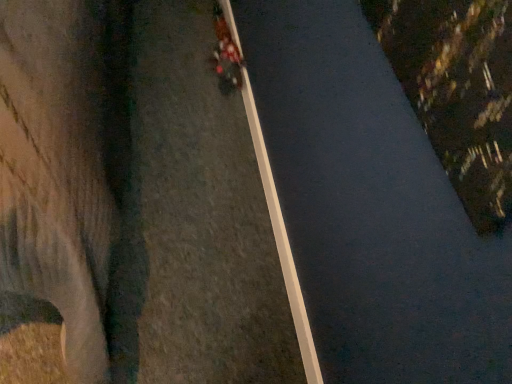
Question: Is white smooth curb at center outside metallic red motorcycle at center?

Choices:
 (A) yes
 (B) no

Answer: (A)

Question: From the image's perspective, is white smooth curb at center over metallic red motorcycle at center?

Choices:
 (A) yes
 (B) no

Answer: (B)

Question: Does white smooth curb at center have a smaller size compared to metallic red motorcycle at center?

Choices:
 (A) yes
 (B) no

Answer: (A)

Question: Is white smooth curb at center positioned before metallic red motorcycle at center?

Choices:
 (A) yes
 (B) no

Answer: (A)

Question: From a real-world perspective, is white smooth curb at center physically below metallic red motorcycle at center?

Choices:
 (A) no
 (B) yes

Answer: (B)

Question: Considering the relative positions of white smooth curb at center and metallic red motorcycle at center in the image provided, is white smooth curb at center to the left of metallic red motorcycle at center from the viewer's perspective?

Choices:
 (A) yes
 (B) no

Answer: (B)

Question: From the image's perspective, is metallic red motorcycle at center on top of white smooth curb at center?

Choices:
 (A) no
 (B) yes

Answer: (B)

Question: Considering the relative sizes of metallic red motorcycle at center and white smooth curb at center in the image provided, is metallic red motorcycle at center bigger than white smooth curb at center?

Choices:
 (A) yes
 (B) no

Answer: (A)

Question: Can you confirm if metallic red motorcycle at center is thinner than white smooth curb at center?

Choices:
 (A) no
 (B) yes

Answer: (A)

Question: Is metallic red motorcycle at center shorter than white smooth curb at center?

Choices:
 (A) no
 (B) yes

Answer: (A)

Question: From a real-world perspective, is metallic red motorcycle at center located higher than white smooth curb at center?

Choices:
 (A) no
 (B) yes

Answer: (B)

Question: Is metallic red motorcycle at center not inside white smooth curb at center?

Choices:
 (A) yes
 (B) no

Answer: (A)

Question: Choose the correct answer: Is white smooth curb at center inside metallic red motorcycle at center or outside it?

Choices:
 (A) outside
 (B) inside

Answer: (A)